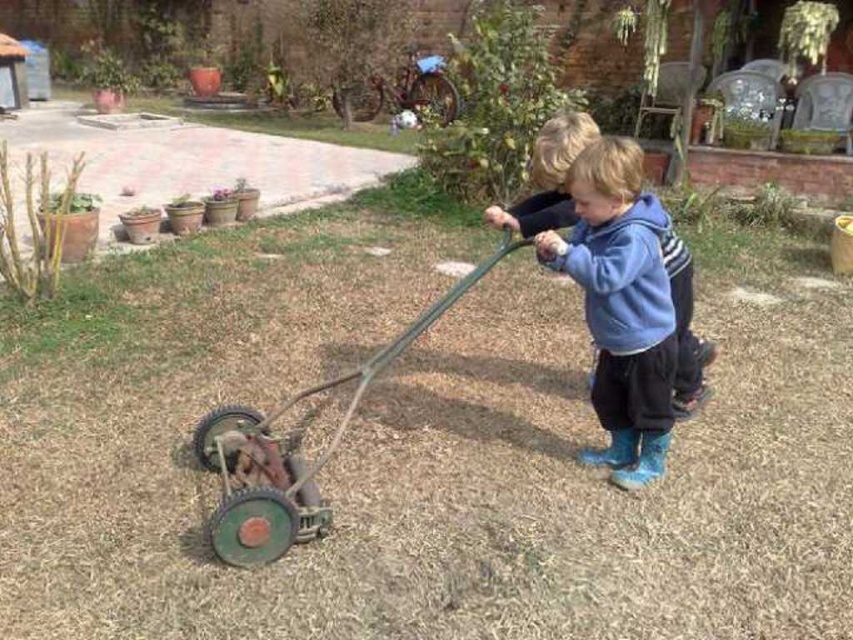
You are a delivery person who needs to place a package on the ground near the rusty metal wagon at lower left. According to the image, where exactly should you place the package?

The rusty metal wagon at lower left is located at point (289, 454). So you should place the package near that coordinate.

You are a parent trying to ensure your children play safely. The rusty metal wagon at lower left is 1.26 meters away from the blue fleece hoodie at center. If the safe distance for the wagon to prevent accidents is 1.5 meters, is the current distance sufficient?

The distance between the rusty metal wagon at lower left and the blue fleece hoodie at center is 1.26 meters, which is less than the required 1.5 meters for safety. Therefore, the current distance is not sufficient to prevent accidents.